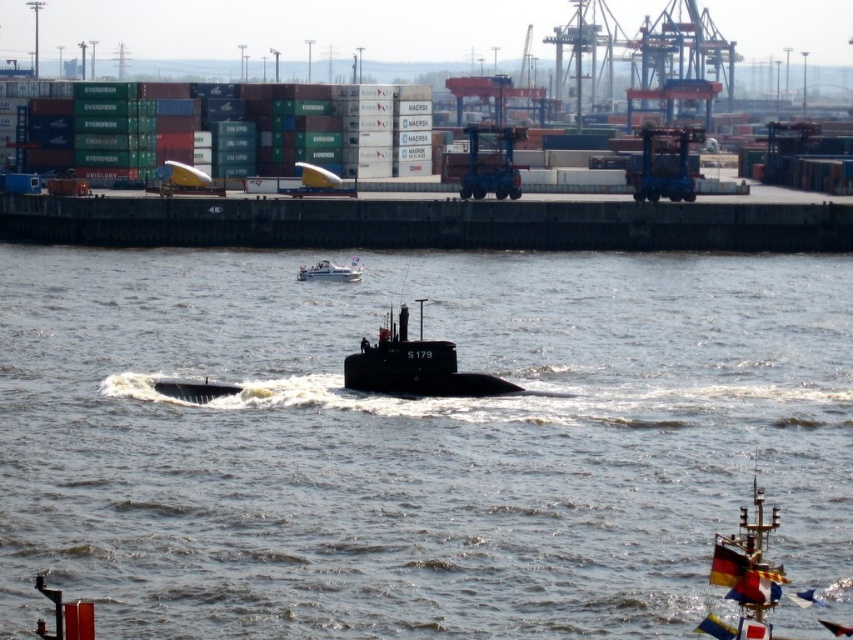
Between black matte submarine at center and white glossy boat at upper center, which one has more height?

black matte submarine at center

Does point (427, 339) lie in front of point (357, 264)?

Yes.

Is point (363, 362) positioned in front of point (352, 273)?

Yes, point (363, 362) is closer to viewer.

You are a GUI agent. You are given a task and a screenshot of the screen. Output one action in this format:
    pyautogui.click(x=<x>, y=<y>)
    Task: Click on the black matte submarine at center
    
    Given the screenshot: What is the action you would take?
    pyautogui.click(x=415, y=365)

Can you confirm if transparent water at center is smaller than green matte containers at upper left?

Actually, transparent water at center might be larger than green matte containers at upper left.

Is point (558, 268) farther from viewer compared to point (306, 115)?

No, (558, 268) is closer to viewer.

In order to click on transparent water at center in this screenshot , I will do `click(416, 442)`.

Which is below, green matte containers at upper left or white glossy boat at upper center?

Positioned lower is white glossy boat at upper center.

Between point (402, 173) and point (335, 266), which one is positioned behind?

The point (402, 173) is more distant.

Which is behind, point (76, 147) or point (310, 276)?

Positioned behind is point (76, 147).

You are a GUI agent. You are given a task and a screenshot of the screen. Output one action in this format:
    pyautogui.click(x=<x>, y=<y>)
    Task: Click on the green matte containers at upper left
    
    Given the screenshot: What is the action you would take?
    (225, 129)